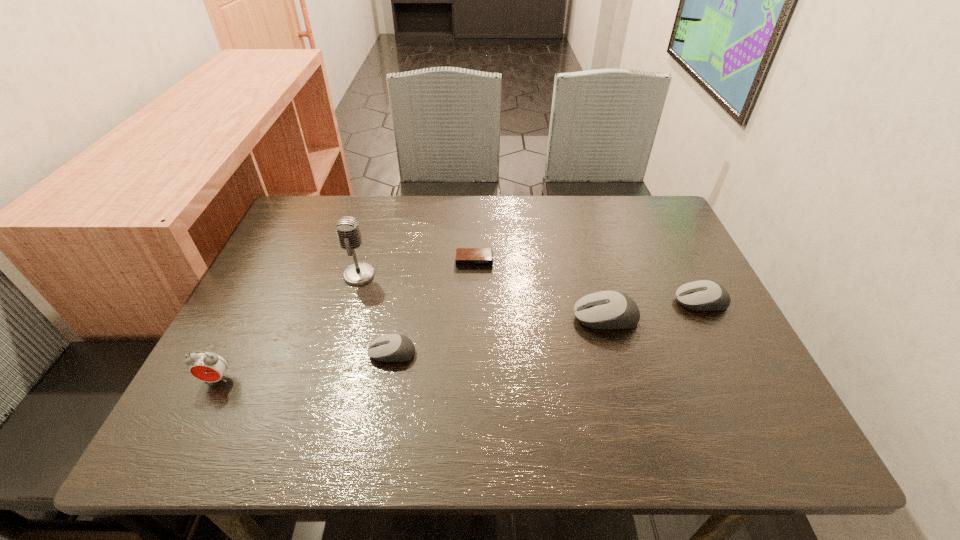
To ensure equal spacing by inserting another mouse_(computer_equipment) among them, please point out a vacant spot for this new mouse_(computer_equipment). Please provide its 2D coordinates. Your answer should be formatted as a tuple, i.e. [(x, y)], where the tuple contains the x and y coordinates of a point satisfying the conditions above.

[(503, 335)]